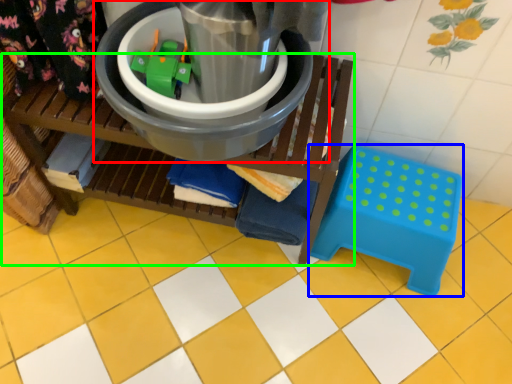
Question: Which object is the farthest from appliance (highlighted by a red box)? Choose among these: step stool (highlighted by a blue box) or furniture (highlighted by a green box).

Choices:
 (A) step stool
 (B) furniture

Answer: (A)